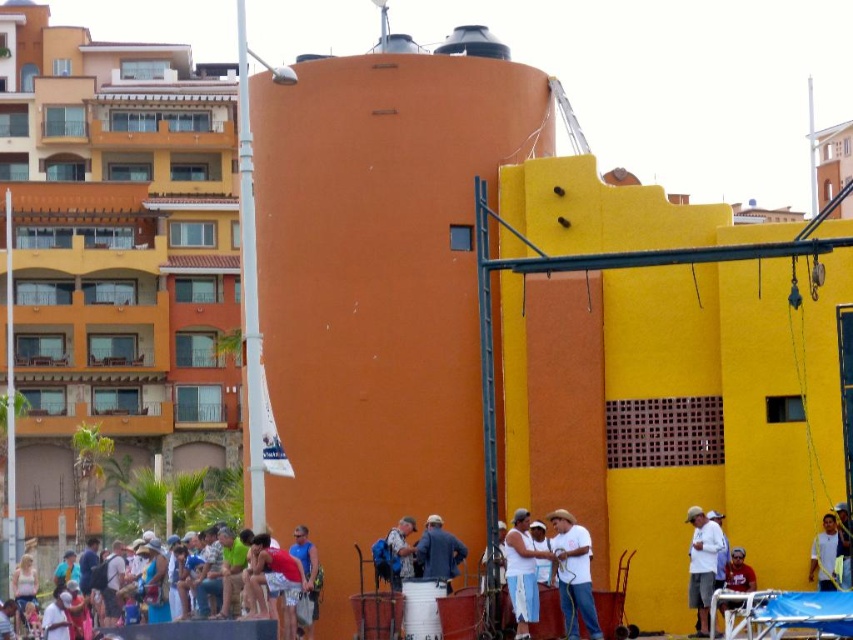
Does matte blue shirt at center have a greater width compared to white matte shirt at lower right?

Incorrect, matte blue shirt at center's width does not surpass white matte shirt at lower right's.

This screenshot has width=853, height=640. I want to click on matte blue shirt at center, so click(x=247, y=602).

This screenshot has width=853, height=640. What are the coordinates of `matte blue shirt at center` in the screenshot? It's located at (247, 602).

Does blue fabric shirt at lower center have a larger size compared to denim jacket at lower center?

Correct, blue fabric shirt at lower center is larger in size than denim jacket at lower center.

Is blue fabric shirt at lower center positioned in front of denim jacket at lower center?

No, it is not.

In order to click on blue fabric shirt at lower center in this screenshot , I will do `click(306, 563)`.

Identify the location of blue fabric shirt at lower center. The image size is (853, 640). (306, 563).

Is dark blue fabric jacket at center smaller than blue fabric shirt at lower center?

No.

Is point (456, 538) positioned behind point (315, 566)?

That is False.

Does point (434, 564) lie behind point (317, 600)?

That is False.

Find the location of a particular element. dark blue fabric jacket at center is located at coordinates (438, 552).